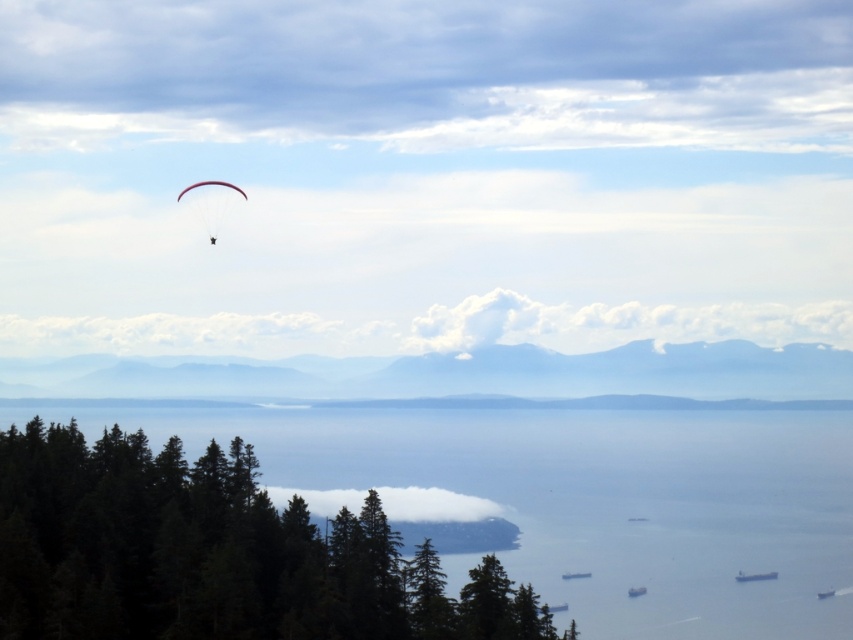
You are standing at the viewpoint observing the coastal landscape. You notice two points marked in the image. Which point, point (299, 616) or point (474, 499), is nearer to your current position?

Point (299, 616) is closer to the camera than point (474, 499), so the point (299, 616) is nearer to your current position.

You are a hiker who wants to take a photo of the green matte trees at lower left and the matte white parachute at upper left. Since you want both objects to be clearly visible in the photo, which object should you focus on first?

You should focus on the green matte trees at lower left first because they are larger in size compared to the matte white parachute at upper left, making them easier to spot and ensure clarity.